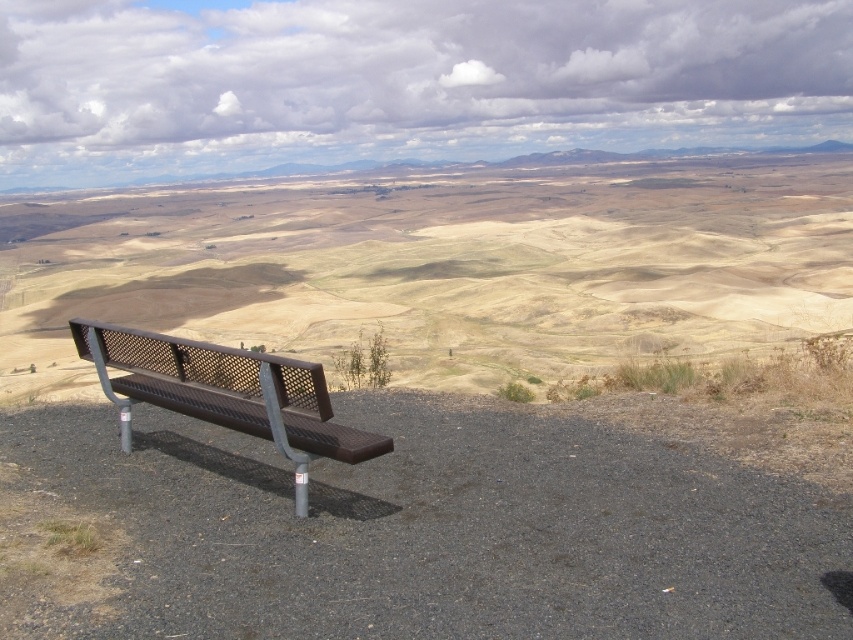
Question: Which point appears farthest from the camera in this image?

Choices:
 (A) (172, 337)
 (B) (273, 317)

Answer: (B)

Question: Where is brown textured bench at lower left located in relation to brown metal bench at lower left in the image?

Choices:
 (A) above
 (B) below

Answer: (A)

Question: Considering the relative positions of brown textured bench at lower left and brown metal bench at lower left in the image provided, where is brown textured bench at lower left located with respect to brown metal bench at lower left?

Choices:
 (A) above
 (B) below

Answer: (A)

Question: Which of the following is the closest to the observer?

Choices:
 (A) brown textured bench at lower left
 (B) brown metal bench at lower left

Answer: (B)

Question: Is brown textured bench at lower left thinner than brown metal bench at lower left?

Choices:
 (A) no
 (B) yes

Answer: (A)

Question: Which of the following is the farthest from the observer?

Choices:
 (A) brown textured bench at lower left
 (B) brown metal bench at lower left

Answer: (A)